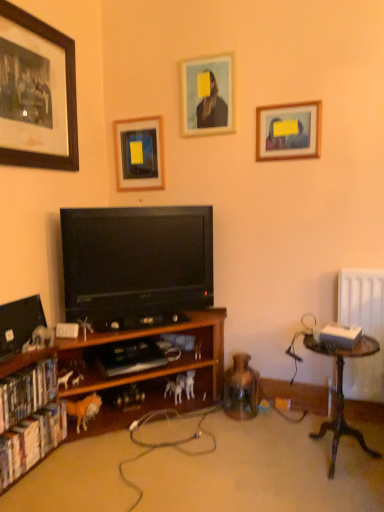
Where is `space that is in front of wooden table at right`? Image resolution: width=384 pixels, height=512 pixels. space that is in front of wooden table at right is located at coordinates (338, 495).